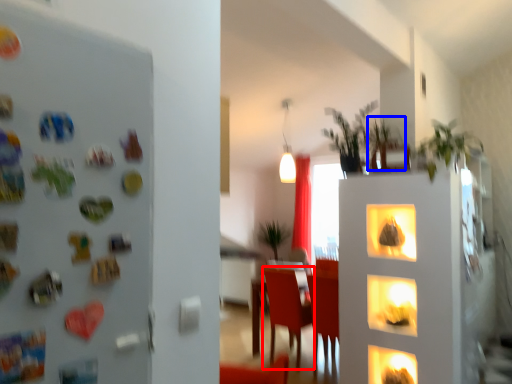
Question: Which point is further to the camera, armchair (highlighted by a red box) or plant (highlighted by a blue box)?

Choices:
 (A) armchair
 (B) plant

Answer: (A)